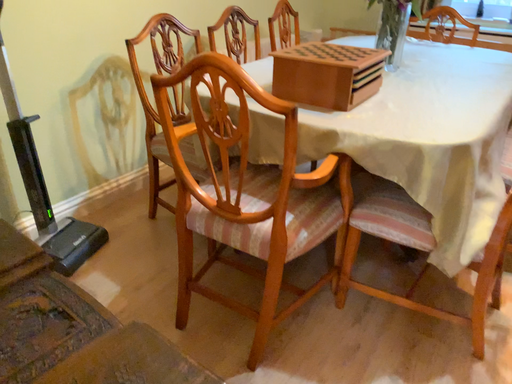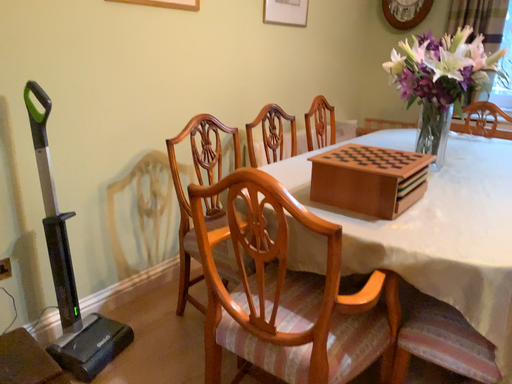
Question: Which way did the camera rotate in the video?

Choices:
 (A) rotated upward
 (B) rotated downward

Answer: (A)